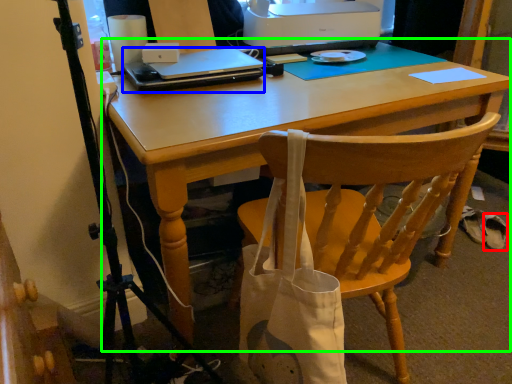
Question: Estimate the real-world distances between objects in this image. Which object is farther from walking shoe (highlighted by a red box), laptop (highlighted by a blue box) or computer desk (highlighted by a green box)?

Choices:
 (A) laptop
 (B) computer desk

Answer: (A)